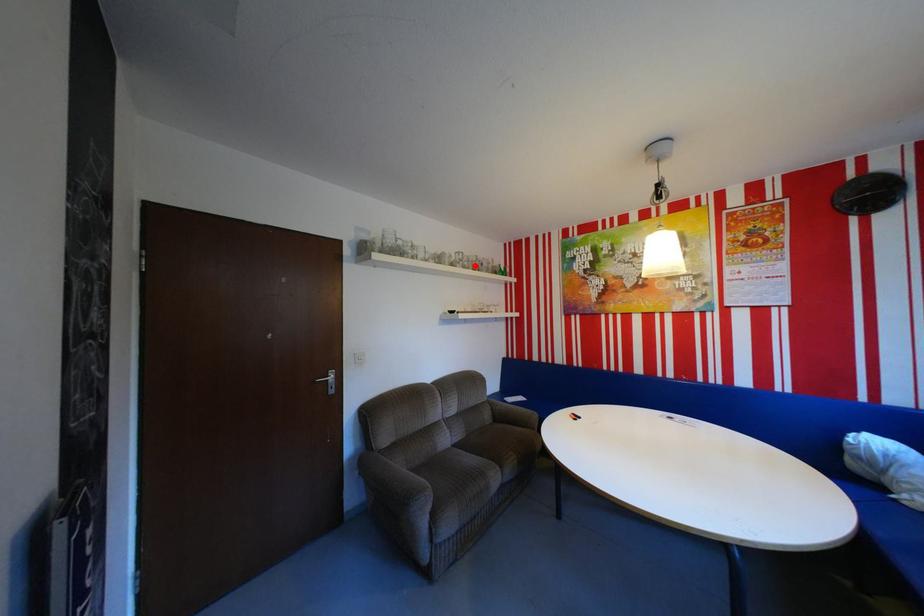
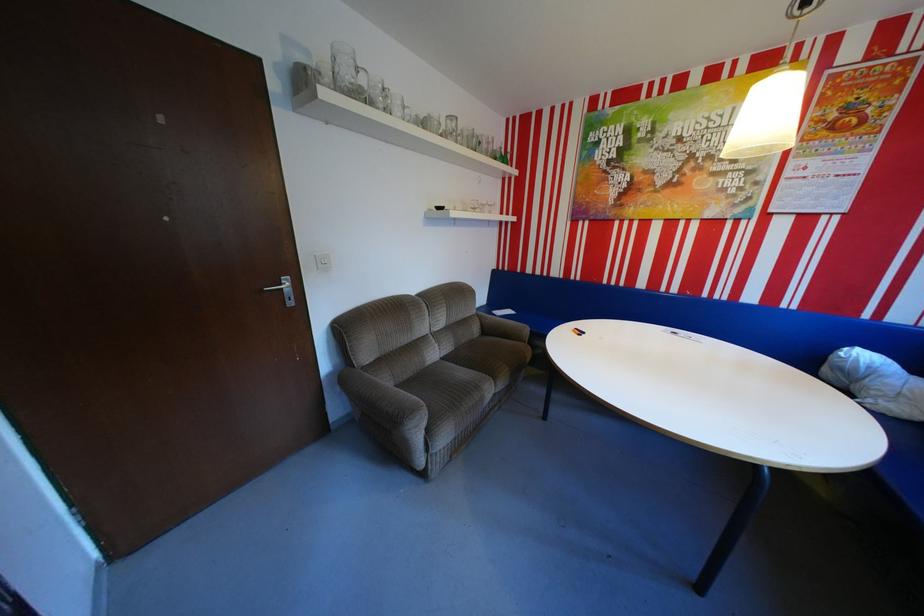
The point at the highlighted location is marked in the first image. Where is the corresponding point in the second image?

(468, 140)